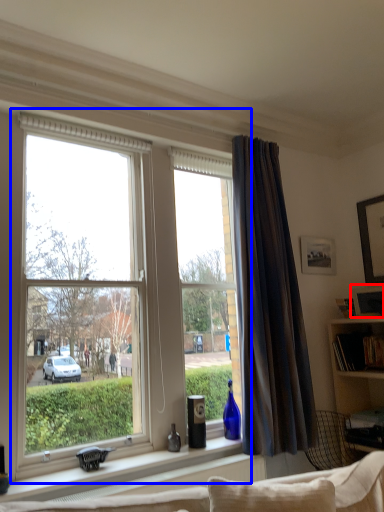
Question: Which object appears closest to the camera in this image, picture frame (highlighted by a red box) or window (highlighted by a blue box)?

Choices:
 (A) picture frame
 (B) window

Answer: (B)